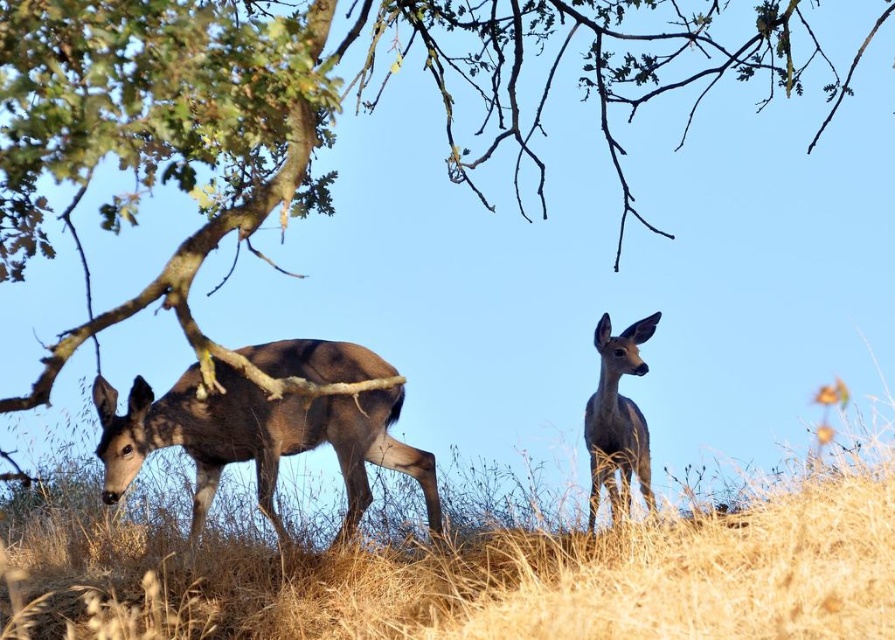
Locate an element on the screen. This screenshot has width=895, height=640. brown matte deer at left is located at coordinates (256, 440).

The height and width of the screenshot is (640, 895). What do you see at coordinates (256, 440) in the screenshot? I see `brown matte deer at left` at bounding box center [256, 440].

Who is more distant from viewer, (399, 454) or (615, 451)?

Point (399, 454)

Where is `brown matte deer at left`? brown matte deer at left is located at coordinates (256, 440).